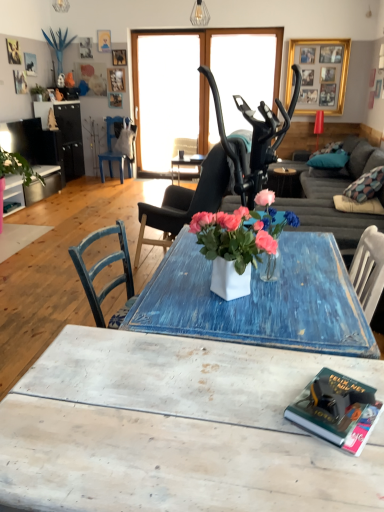
In order to click on vacant area on top of white distressed wood coffee table at lower center (from a real-world perspective) in this screenshot , I will do `click(194, 411)`.